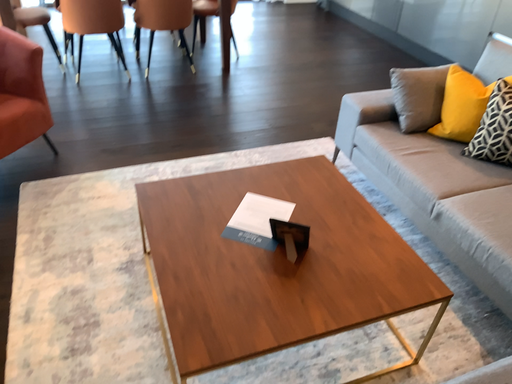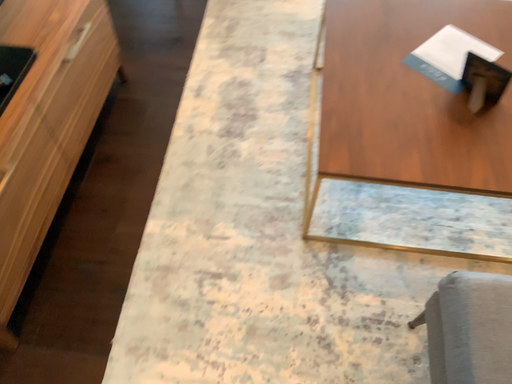
Question: Which way did the camera rotate in the video?

Choices:
 (A) rotated downward
 (B) rotated upward

Answer: (A)